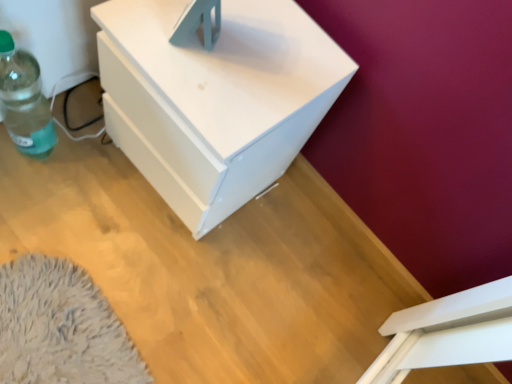
Find the location of `free point behind green translucent bottle at left`. free point behind green translucent bottle at left is located at coordinates (78, 110).